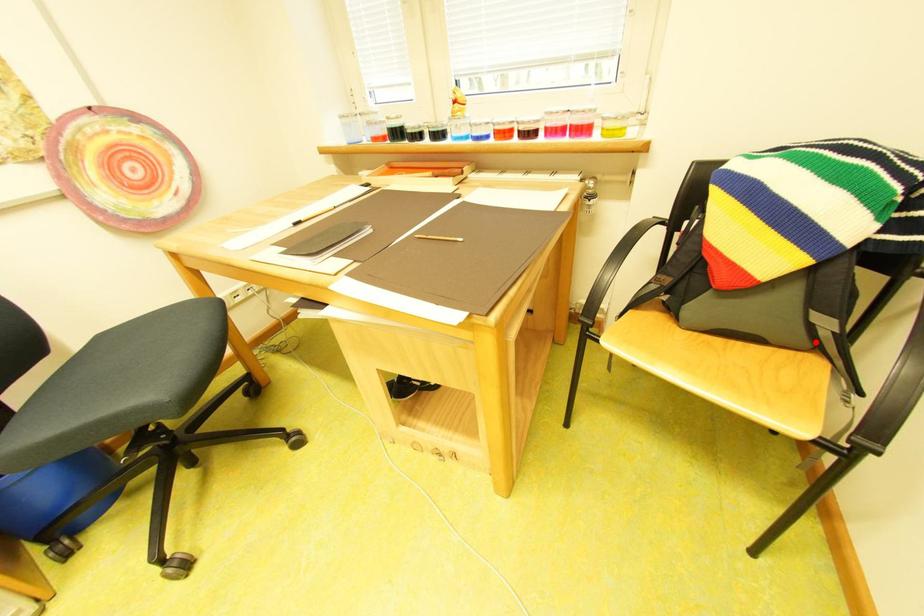
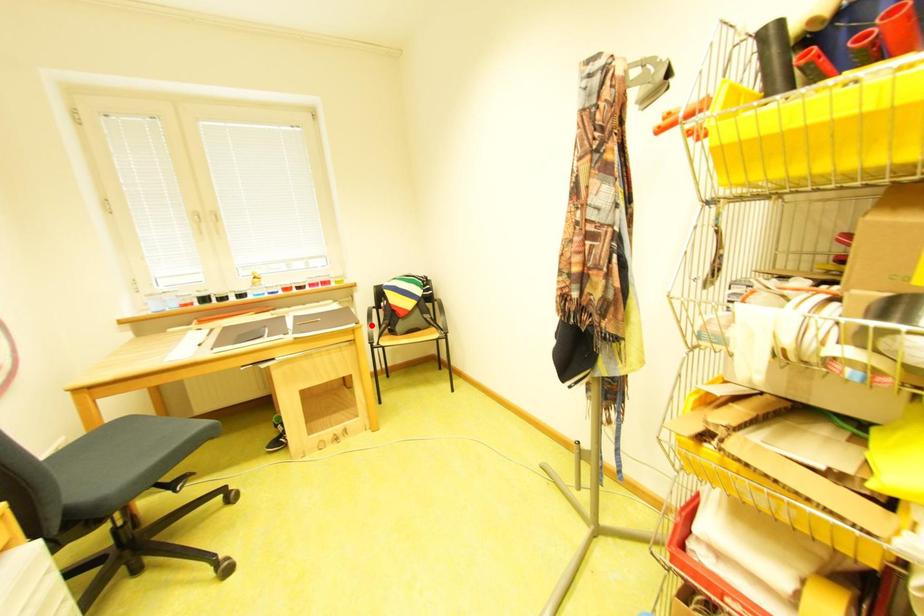
I am providing you with two images of the same scene from different viewpoints. A red point is marked on the first image and another point is marked on the second image. Is the marked point in image1 the same physical position as the marked point in image2?

No